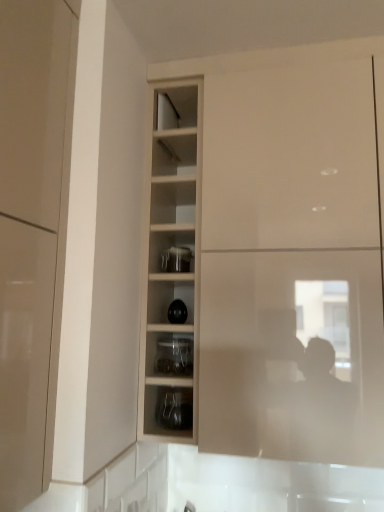
Question: Is glossy beige cabinet at left, the 2th cabinetry in the back-to-front sequence, smaller than matte white cabinet at center, which is the 2th cabinetry in front-to-back order?

Choices:
 (A) yes
 (B) no

Answer: (A)

Question: Does glossy beige cabinet at left, acting as the 1th cabinetry starting from the left, contain matte white cabinet at center, the 1th cabinetry positioned from the right?

Choices:
 (A) yes
 (B) no

Answer: (B)

Question: Is glossy beige cabinet at left, which is the first cabinetry in front-to-back order, completely or partially outside of matte white cabinet at center, marked as the first cabinetry in a back-to-front arrangement?

Choices:
 (A) no
 (B) yes

Answer: (B)

Question: From the image's perspective, is glossy beige cabinet at left, which is the first cabinetry in front-to-back order, on top of matte white cabinet at center, the second cabinetry in the left-to-right sequence?

Choices:
 (A) no
 (B) yes

Answer: (B)

Question: Is glossy beige cabinet at left, acting as the 1th cabinetry starting from the left, taller than matte white cabinet at center, the 1th cabinetry positioned from the right?

Choices:
 (A) yes
 (B) no

Answer: (B)

Question: Is the position of glossy beige cabinet at left, which is the first cabinetry in front-to-back order, more distant than that of matte white cabinet at center, the second cabinetry in the left-to-right sequence?

Choices:
 (A) no
 (B) yes

Answer: (A)

Question: Is wooden shelves at center at the right side of matte white cabinet at center, the second cabinetry in the left-to-right sequence?

Choices:
 (A) no
 (B) yes

Answer: (A)

Question: Is wooden shelves at center positioned behind matte white cabinet at center, the second cabinetry in the left-to-right sequence?

Choices:
 (A) yes
 (B) no

Answer: (A)

Question: Does wooden shelves at center have a lesser width compared to matte white cabinet at center, the second cabinetry in the left-to-right sequence?

Choices:
 (A) no
 (B) yes

Answer: (B)

Question: Can you confirm if wooden shelves at center is smaller than matte white cabinet at center, which is the 2th cabinetry in front-to-back order?

Choices:
 (A) no
 (B) yes

Answer: (B)

Question: Could you tell me if wooden shelves at center is turned towards matte white cabinet at center, the 1th cabinetry positioned from the right?

Choices:
 (A) yes
 (B) no

Answer: (B)

Question: Does wooden shelves at center contain matte white cabinet at center, which is the 2th cabinetry in front-to-back order?

Choices:
 (A) no
 (B) yes

Answer: (A)

Question: From the image's perspective, is clear glass jar at center, placed as the first shelf when sorted from top to bottom, below glossy beige cabinet at left, positioned as the second cabinetry in right-to-left order?

Choices:
 (A) no
 (B) yes

Answer: (B)